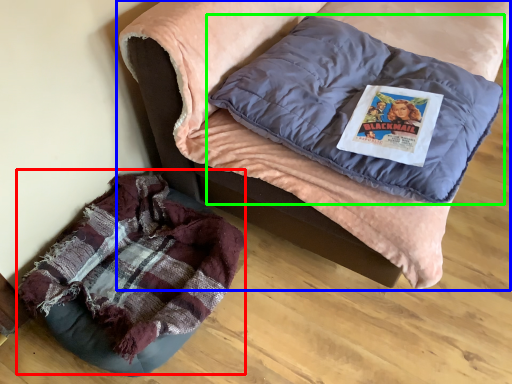
Question: Which is nearer to the bean bag chair (highlighted by a red box)? furniture (highlighted by a blue box) or pillow (highlighted by a green box).

Choices:
 (A) furniture
 (B) pillow

Answer: (A)